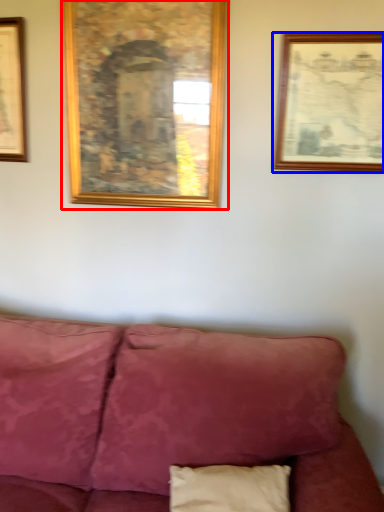
Question: Which point is further to the camera, picture frame (highlighted by a red box) or picture frame (highlighted by a blue box)?

Choices:
 (A) picture frame
 (B) picture frame

Answer: (A)